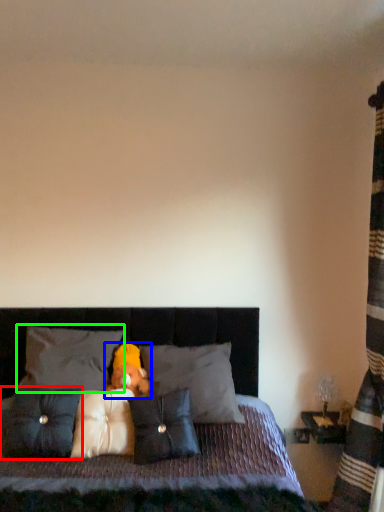
Question: Considering the real-world distances, which object is closest to pillow (highlighted by a red box)? teddy bear (highlighted by a blue box) or pillow (highlighted by a green box).

Choices:
 (A) teddy bear
 (B) pillow

Answer: (B)